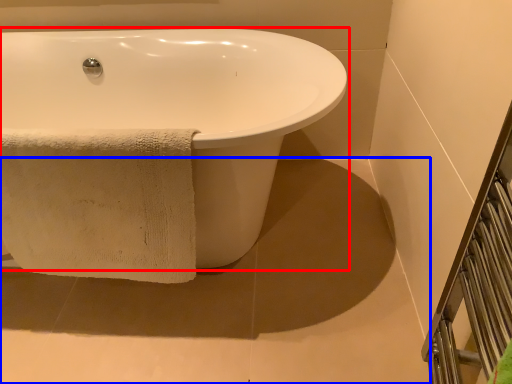
Question: Which point is further to the camera, bathtub (highlighted by a red box) or concrete (highlighted by a blue box)?

Choices:
 (A) bathtub
 (B) concrete

Answer: (B)